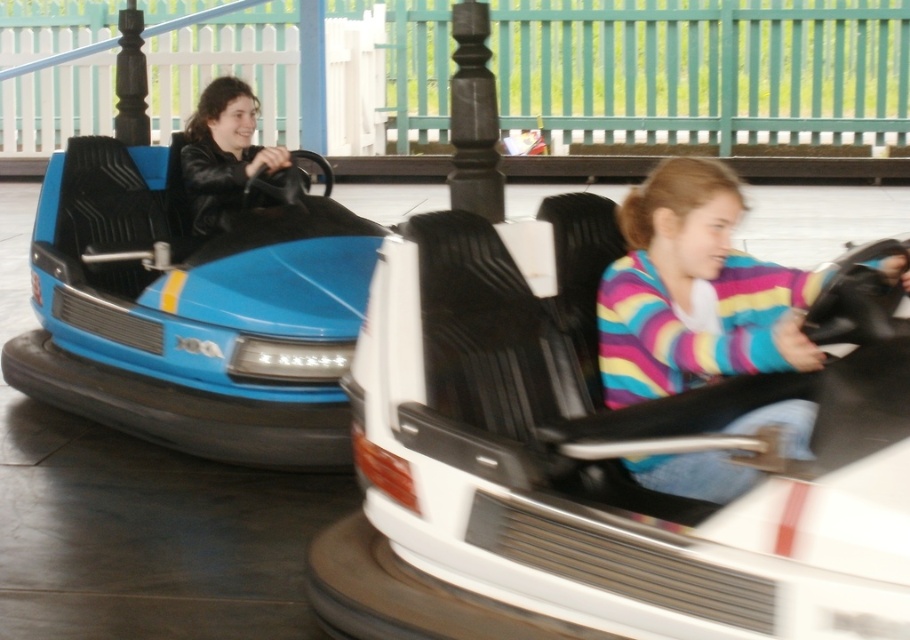
Question: Estimate the real-world distances between objects in this image. Which object is farther from the striped sweater at center?

Choices:
 (A) white glossy bumper car at center
 (B) matte black jacket at left

Answer: (B)

Question: Can you confirm if striped sweater at center is smaller than matte black jacket at left?

Choices:
 (A) no
 (B) yes

Answer: (A)

Question: Which of the following is the farthest from the observer?

Choices:
 (A) white glossy bumper car at center
 (B) matte black jacket at left

Answer: (B)

Question: Does white glossy bumper car at center have a smaller size compared to matte black jacket at left?

Choices:
 (A) no
 (B) yes

Answer: (A)

Question: Does white glossy bumper car at center appear on the right side of striped sweater at center?

Choices:
 (A) yes
 (B) no

Answer: (B)

Question: Which point is closer to the camera taking this photo?

Choices:
 (A) (784, 480)
 (B) (676, 328)
 (C) (218, 120)

Answer: (A)